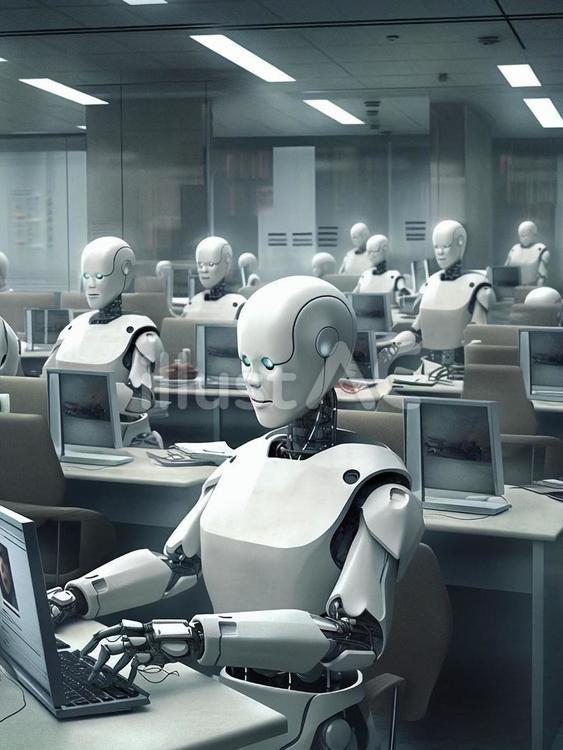
The height and width of the screenshot is (750, 563). I want to click on ceiling light, so click(518, 80), click(542, 108), click(267, 70), click(330, 106), click(64, 99), click(81, 128), click(7, 60), click(144, 4).